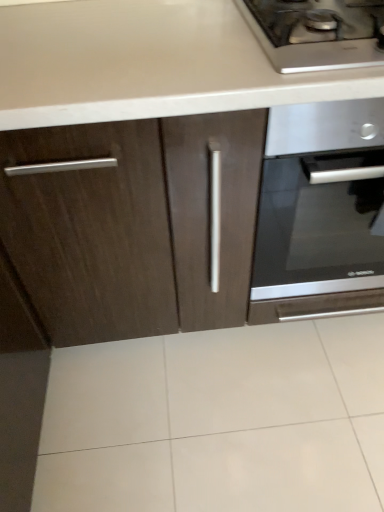
Question: From a real-world perspective, is satin silver oven at center-right below stainless steel gas stove at upper right?

Choices:
 (A) no
 (B) yes

Answer: (B)

Question: Considering the relative positions of satin silver oven at center-right and stainless steel gas stove at upper right in the image provided, is satin silver oven at center-right to the left of stainless steel gas stove at upper right from the viewer's perspective?

Choices:
 (A) no
 (B) yes

Answer: (A)

Question: Does satin silver oven at center-right have a lesser height compared to stainless steel gas stove at upper right?

Choices:
 (A) yes
 (B) no

Answer: (B)

Question: Is satin silver oven at center-right far from stainless steel gas stove at upper right?

Choices:
 (A) no
 (B) yes

Answer: (A)

Question: Is satin silver oven at center-right positioned with its back to stainless steel gas stove at upper right?

Choices:
 (A) yes
 (B) no

Answer: (B)

Question: Can we say satin silver oven at center-right lies outside stainless steel gas stove at upper right?

Choices:
 (A) yes
 (B) no

Answer: (A)

Question: Considering the relative sizes of stainless steel gas stove at upper right and satin silver oven at center-right in the image provided, is stainless steel gas stove at upper right bigger than satin silver oven at center-right?

Choices:
 (A) yes
 (B) no

Answer: (B)

Question: Does stainless steel gas stove at upper right have a greater height compared to satin silver oven at center-right?

Choices:
 (A) yes
 (B) no

Answer: (B)

Question: Is stainless steel gas stove at upper right at the right side of satin silver oven at center-right?

Choices:
 (A) no
 (B) yes

Answer: (A)

Question: Is stainless steel gas stove at upper right aimed at satin silver oven at center-right?

Choices:
 (A) no
 (B) yes

Answer: (A)

Question: Considering the relative sizes of stainless steel gas stove at upper right and satin silver oven at center-right in the image provided, is stainless steel gas stove at upper right wider than satin silver oven at center-right?

Choices:
 (A) no
 (B) yes

Answer: (A)

Question: Is stainless steel gas stove at upper right positioned behind satin silver oven at center-right?

Choices:
 (A) yes
 (B) no

Answer: (B)

Question: Is point (352, 56) closer or farther from the camera than point (268, 125)?

Choices:
 (A) farther
 (B) closer

Answer: (B)